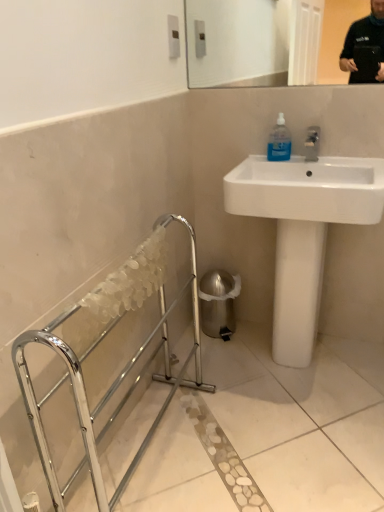
Question: Considering the positions of white glossy sink at upper right and chrome metallic balustrade at lower left in the image, is white glossy sink at upper right taller or shorter than chrome metallic balustrade at lower left?

Choices:
 (A) tall
 (B) short

Answer: (A)

Question: Is white glossy sink at upper right to the left or to the right of chrome metallic balustrade at lower left in the image?

Choices:
 (A) left
 (B) right

Answer: (B)

Question: Estimate the real-world distances between objects in this image. Which object is closer to the shiny metallic trash can at lower right?

Choices:
 (A) white glossy sink at upper right
 (B) chrome metallic balustrade at lower left
 (C) transparent plastic bottle at upper right

Answer: (B)

Question: Considering the real-world distances, which object is farthest from the transparent plastic bottle at upper right?

Choices:
 (A) chrome metallic balustrade at lower left
 (B) shiny metallic trash can at lower right
 (C) white glossy sink at upper right

Answer: (A)